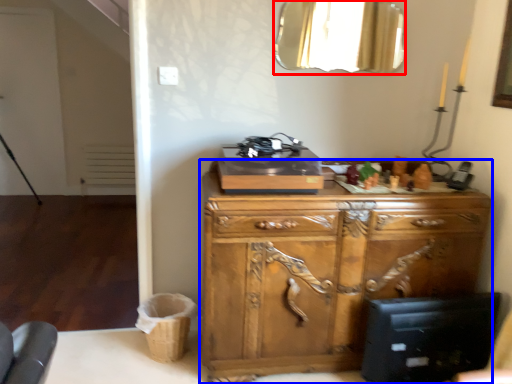
Question: Which object appears closest to the camera in this image, mirror (highlighted by a red box) or chest of drawers (highlighted by a blue box)?

Choices:
 (A) mirror
 (B) chest of drawers

Answer: (B)